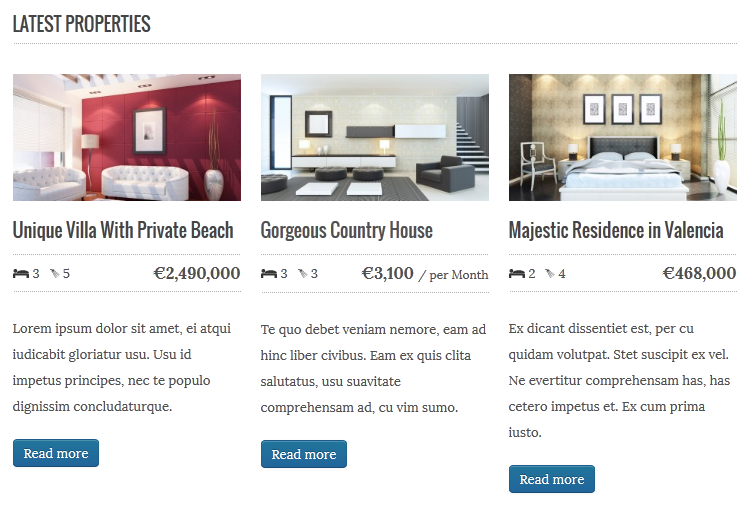
The width and height of the screenshot is (754, 520). I want to click on mirror, so click(314, 121).